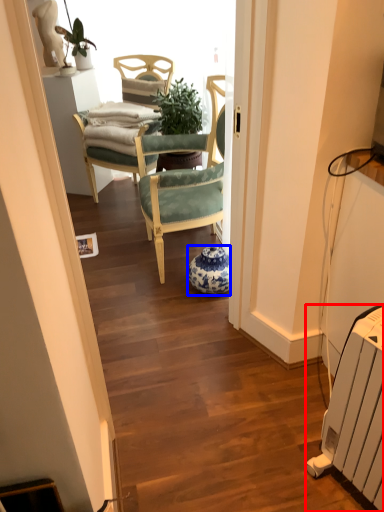
Question: Which of the following is the farthest to the observer, radiator (highlighted by a red box) or vase (highlighted by a blue box)?

Choices:
 (A) radiator
 (B) vase

Answer: (B)